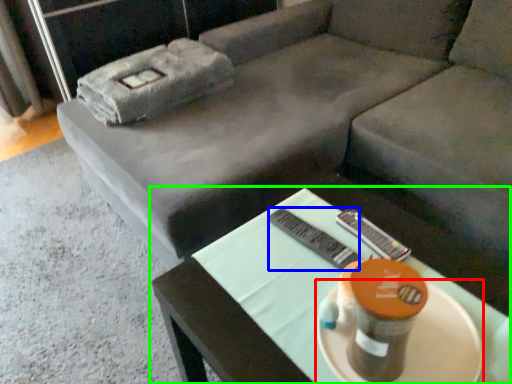
Question: Estimate the real-world distances between objects in this image. Which object is farther from platter (highlighted by a red box), remote (highlighted by a blue box) or table (highlighted by a green box)?

Choices:
 (A) remote
 (B) table

Answer: (A)